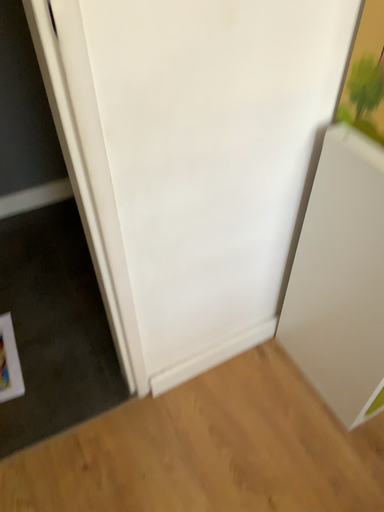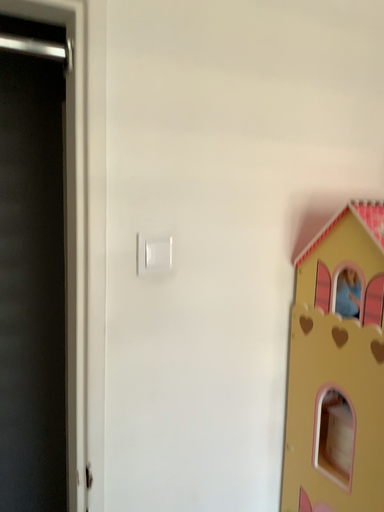
Question: Which way did the camera rotate in the video?

Choices:
 (A) rotated downward
 (B) rotated upward

Answer: (B)